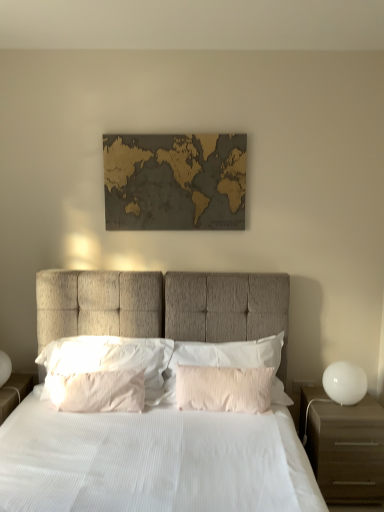
Identify the location of space that is in front of white glossy sphere at right. (352, 416).